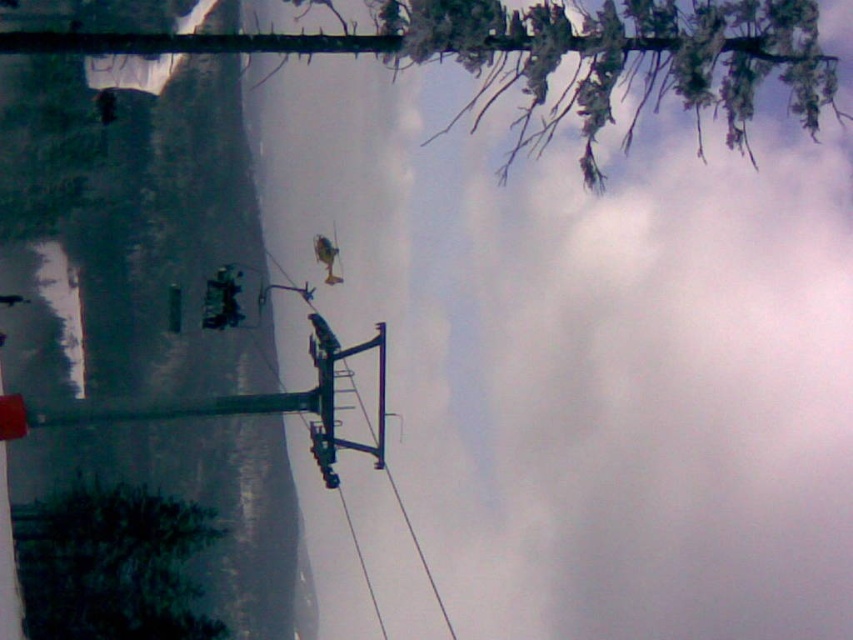
Can you confirm if smooth snow at left is positioned to the right of green matte tree at lower left?

Yes, smooth snow at left is to the right of green matte tree at lower left.

Is smooth snow at left positioned before green matte tree at lower left?

Yes, smooth snow at left is closer to the viewer.

Locate an element on the screen. smooth snow at left is located at coordinates (126, 232).

The image size is (853, 640). I want to click on smooth snow at left, so (126, 232).

Is point (752, 13) closer to viewer compared to point (409, 525)?

Yes.

Identify the location of snow-covered branches at upper center. The height and width of the screenshot is (640, 853). (555, 52).

Can you confirm if green matte tree at lower left is positioned below black wire at upper center?

Yes.

Who is lower down, green matte tree at lower left or black wire at upper center?

green matte tree at lower left

The height and width of the screenshot is (640, 853). Describe the element at coordinates (112, 564) in the screenshot. I see `green matte tree at lower left` at that location.

This screenshot has height=640, width=853. I want to click on green matte tree at lower left, so click(x=112, y=564).